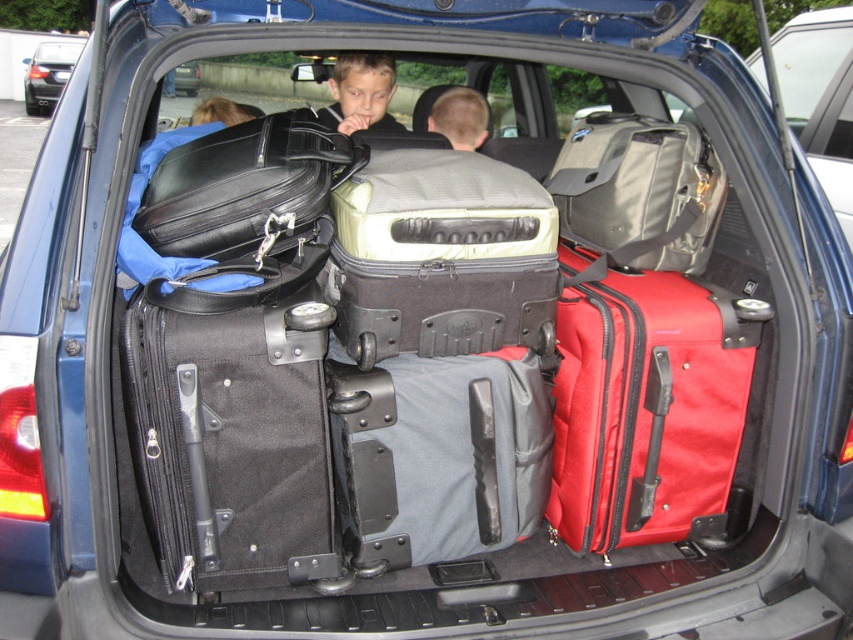
Between red fabric suitcase at right and matte black suitcase at center, which one has more height?

red fabric suitcase at right

Can you confirm if red fabric suitcase at right is positioned above matte black suitcase at center?

No.

Is point (630, 317) positioned before point (180, 81)?

That is True.

The height and width of the screenshot is (640, 853). I want to click on red fabric suitcase at right, so click(647, 408).

Can you confirm if black fabric suitcase at center is positioned to the right of matte black suitcase at center?

Yes, black fabric suitcase at center is to the right of matte black suitcase at center.

Is black fabric suitcase at center shorter than matte black suitcase at center?

Incorrect, black fabric suitcase at center's height does not fall short of matte black suitcase at center's.

Is point (190, 420) closer to viewer compared to point (173, 84)?

Yes, point (190, 420) is in front of point (173, 84).

The width and height of the screenshot is (853, 640). Find the location of `black fabric suitcase at center`. black fabric suitcase at center is located at coordinates (229, 445).

Between point (181, 493) and point (666, 161), which one is positioned behind?

The point (666, 161) is more distant.

Looking at this image, does black fabric suitcase at center appear over matte gray backpack at center?

No.

What do you see at coordinates (229, 445) in the screenshot?
I see `black fabric suitcase at center` at bounding box center [229, 445].

Locate an element on the screen. Image resolution: width=853 pixels, height=640 pixels. black fabric suitcase at center is located at coordinates (229, 445).